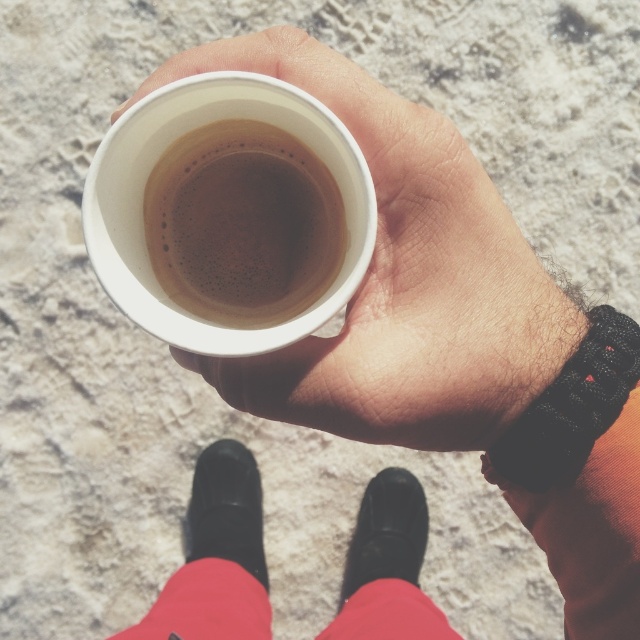
You are a photographer trying to capture the brown matte cup at center and the black leather boot at lower center in a single frame. Since the cup is smaller than the boot, how can you adjust your camera to ensure both are clearly visible in the photo?

The brown matte cup at center is smaller than the black leather boot at lower center. To capture both clearly, position the camera closer to the cup to enlarge its appearance in the frame while ensuring the boot remains in view.

You are a photographer trying to capture the brown matte cup at center and the black leather boot at lower center in a single frame. Based on their positions, which object should you adjust your camera to focus on first if you want to ensure both are in the frame without moving the camera?

The brown matte cup at center is to the right of the black leather boot at lower center. Since the cup is positioned further to the right, you should first focus on the black leather boot at lower center to ensure the camera frame includes both objects without needing to shift the camera position.

You are standing in front of the person holding the white disposable cup. Which of the two points, point [241,515] or point [412,474], is closer to you?

Point [241,515] is closer to you because it is in front of point [412,474].